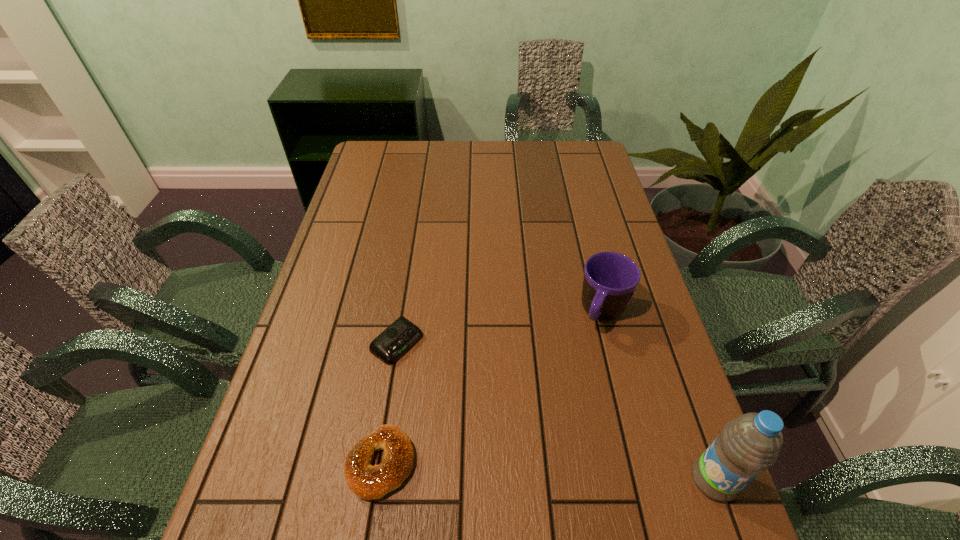
What are the coordinates of `bagel` in the screenshot? It's located at (368, 482).

Locate an element on the screen. This screenshot has width=960, height=540. water bottle is located at coordinates (748, 444).

I want to click on the tallest object, so click(x=748, y=444).

I want to click on the second tallest object, so click(610, 279).

Find the location of a particular element. the third object from left to right is located at coordinates (610, 279).

This screenshot has height=540, width=960. I want to click on the shortest object, so click(390, 345).

Find the location of a particular element. The width and height of the screenshot is (960, 540). vacant space situated on the right of the second shortest object is located at coordinates (578, 463).

Locate an element on the screen. This screenshot has height=540, width=960. vacant area situated on the left of the tallest object is located at coordinates (589, 480).

What are the coordinates of `free region located with the handle on the side of the second tallest object` in the screenshot? It's located at (573, 386).

At what (x,y) coordinates should I click in order to perform the action: click on free spot located 0.200m with the handle on the side of the second tallest object. Please return your answer as a coordinate pair (x, y). The image size is (960, 540). Looking at the image, I should click on (566, 400).